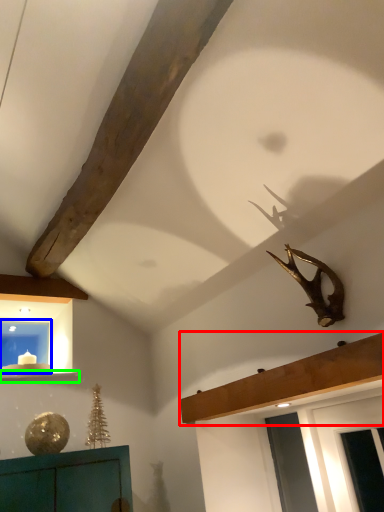
Question: Which object is the farthest from shelf (highlighted by a red box)? Choose among these: window (highlighted by a blue box) or window sill (highlighted by a green box).

Choices:
 (A) window
 (B) window sill

Answer: (A)